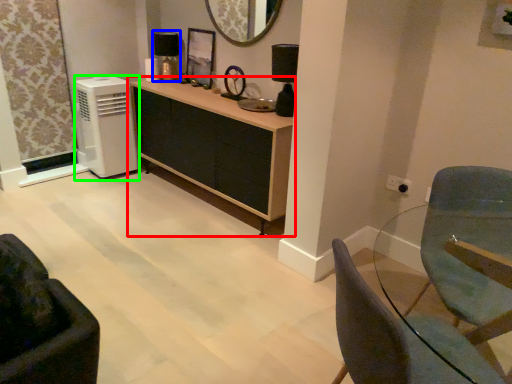
Question: Which object is the farthest from cabinetry (highlighted by a red box)? Choose among these: lamp (highlighted by a blue box) or air conditioning (highlighted by a green box).

Choices:
 (A) lamp
 (B) air conditioning

Answer: (A)